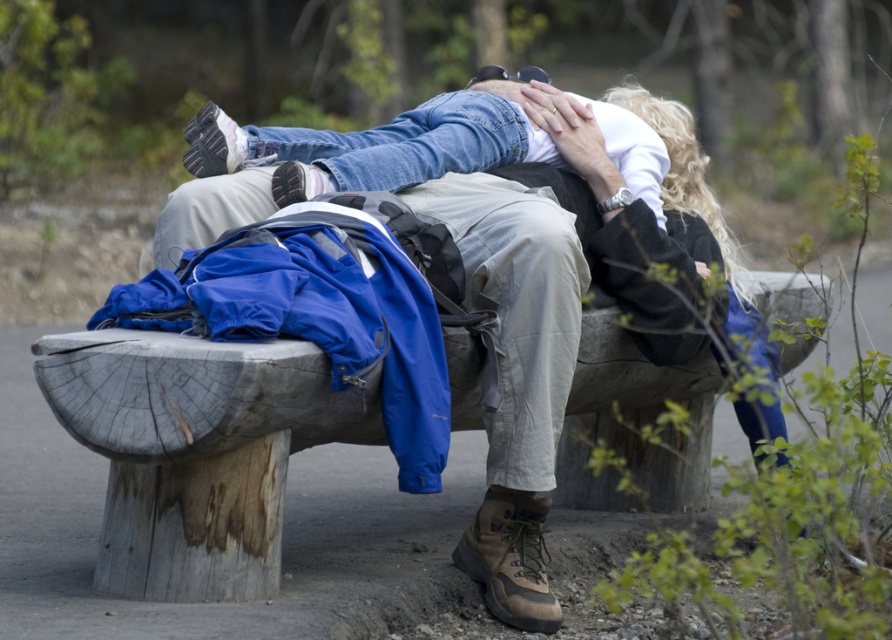
You are standing in front of the weathered wood bench at center. You want to place your backpack on the matte blue jacket at center. Which direction should you move the backpack to ensure it lands on the jacket?

The matte blue jacket at center is to the right of the weathered wood bench at center. So, you should move the backpack to the right side of the bench to place it on the jacket.

You are a photographer trying to capture the matte blue jacket at center and the weathered wood bench at center in a single shot. Since the bench is behind the jacket, which object will appear smaller in the photo?

The weathered wood bench at center will appear smaller in the photo because it is farther away from the camera compared to the matte blue jacket at center.

You are a photographer trying to capture a candid shot of the two people resting on the weathered wood bench at center. You want to ensure the matte blue jacket at center is visible in the background without being too close to the bench. Given that the jacket and bench are 60.44 centimeters apart, is this possible?

The matte blue jacket at center and weathered wood bench at center are 60.44 centimeters apart, so yes, the jacket can be visible in the background while maintaining enough distance from the bench to avoid clutter in the photo.